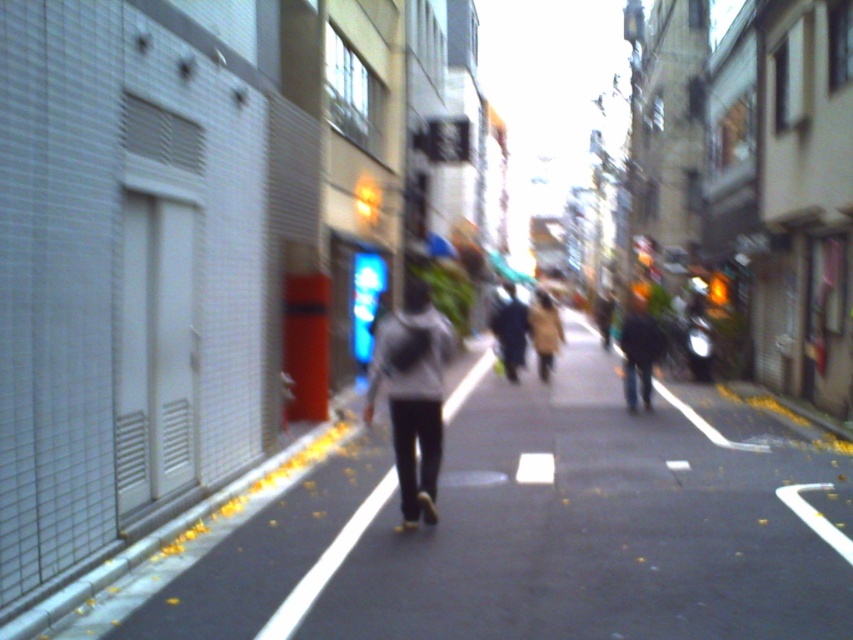
Question: Can you confirm if light gray sweater at center is positioned to the left of dark gray sweater at center?

Choices:
 (A) yes
 (B) no

Answer: (A)

Question: Where is light gray sweater at center located in relation to dark gray sweater at center in the image?

Choices:
 (A) left
 (B) right

Answer: (A)

Question: Can you confirm if light gray sweater at center is positioned to the right of dark gray sweater at center?

Choices:
 (A) no
 (B) yes

Answer: (A)

Question: Which object appears closest to the camera in this image?

Choices:
 (A) dark gray sweater at center
 (B) light gray sweater at center

Answer: (B)

Question: Among these points, which one is nearest to the camera?

Choices:
 (A) (503, 349)
 (B) (398, 400)

Answer: (B)